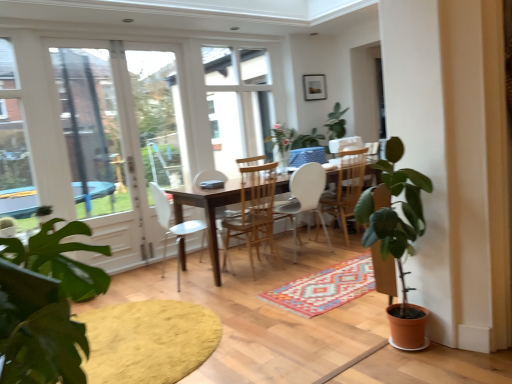
Question: Is yellow textured rug at lower left surrounding terracotta pot plant at right?

Choices:
 (A) no
 (B) yes

Answer: (A)

Question: Considering the relative sizes of yellow textured rug at lower left and terracotta pot plant at right in the image provided, is yellow textured rug at lower left bigger than terracotta pot plant at right?

Choices:
 (A) no
 (B) yes

Answer: (B)

Question: Is yellow textured rug at lower left looking in the opposite direction of terracotta pot plant at right?

Choices:
 (A) yes
 (B) no

Answer: (B)

Question: Is the depth of yellow textured rug at lower left greater than that of terracotta pot plant at right?

Choices:
 (A) no
 (B) yes

Answer: (A)

Question: From a real-world perspective, is yellow textured rug at lower left located higher than terracotta pot plant at right?

Choices:
 (A) no
 (B) yes

Answer: (A)

Question: Is wooden chair at center, the second chair in the left-to-right sequence, inside the boundaries of white matte chair at center, the 2th chair from the right, or outside?

Choices:
 (A) inside
 (B) outside

Answer: (B)

Question: Is point (265, 190) positioned closer to the camera than point (300, 205)?

Choices:
 (A) farther
 (B) closer

Answer: (B)

Question: Relative to white matte chair at center, which appears as the third chair when viewed from the left, is wooden chair at center, the 3th chair when ordered from right to left, in front or behind?

Choices:
 (A) front
 (B) behind

Answer: (A)

Question: From a real-world perspective, is wooden chair at center, the 3th chair when ordered from right to left, positioned above or below white matte chair at center, which appears as the third chair when viewed from the left?

Choices:
 (A) above
 (B) below

Answer: (B)

Question: In terms of size, does yellow textured rug at lower left appear bigger or smaller than wooden table at center?

Choices:
 (A) small
 (B) big

Answer: (A)

Question: Visually, is yellow textured rug at lower left positioned to the left or to the right of wooden table at center?

Choices:
 (A) left
 (B) right

Answer: (A)

Question: Is yellow textured rug at lower left wider or thinner than wooden table at center?

Choices:
 (A) wide
 (B) thin

Answer: (A)

Question: From a real-world perspective, is yellow textured rug at lower left positioned above or below wooden table at center?

Choices:
 (A) above
 (B) below

Answer: (B)

Question: From their relative heights in the image, would you say clear glass screen door at left is taller or shorter than white plastic chair at center, arranged as the 1th chair when viewed from the left?

Choices:
 (A) tall
 (B) short

Answer: (A)

Question: Considering their positions, is clear glass screen door at left located in front of or behind white plastic chair at center, arranged as the 1th chair when viewed from the left?

Choices:
 (A) front
 (B) behind

Answer: (B)